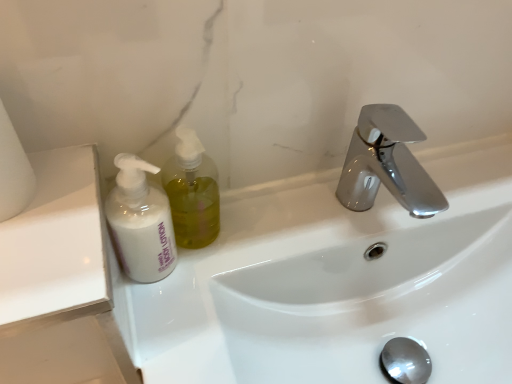
Find the location of a particular element. vacant area that is situated to the right of white matte lotion at left is located at coordinates (252, 239).